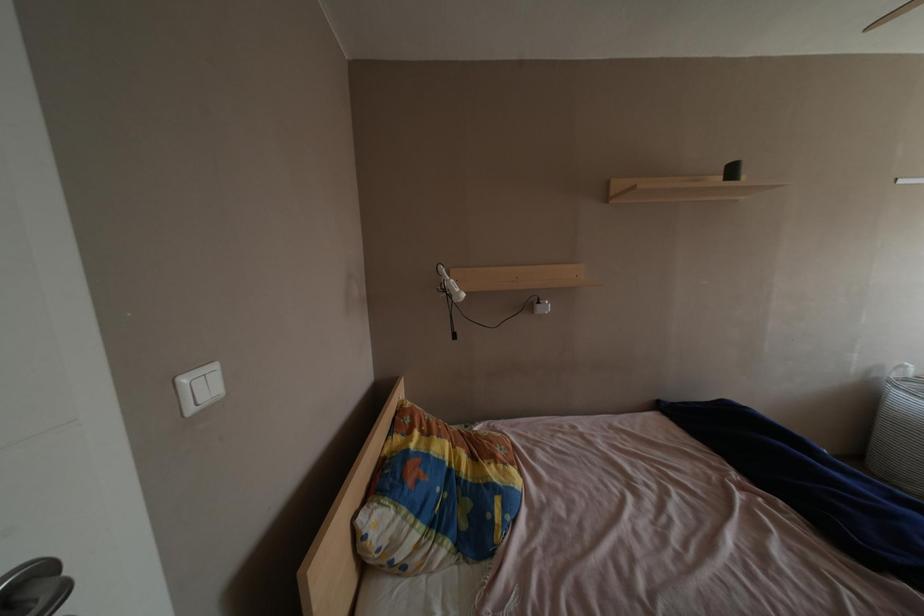
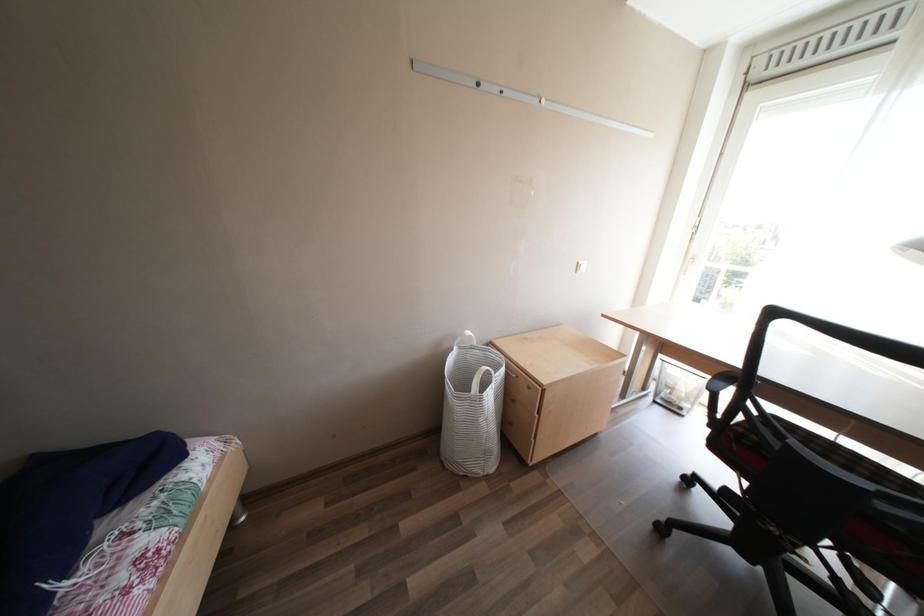
Question: What movement of the cameraman would produce the second image?

Choices:
 (A) Left
 (B) Right
 (C) Forward
 (D) Backward

Answer: (B)